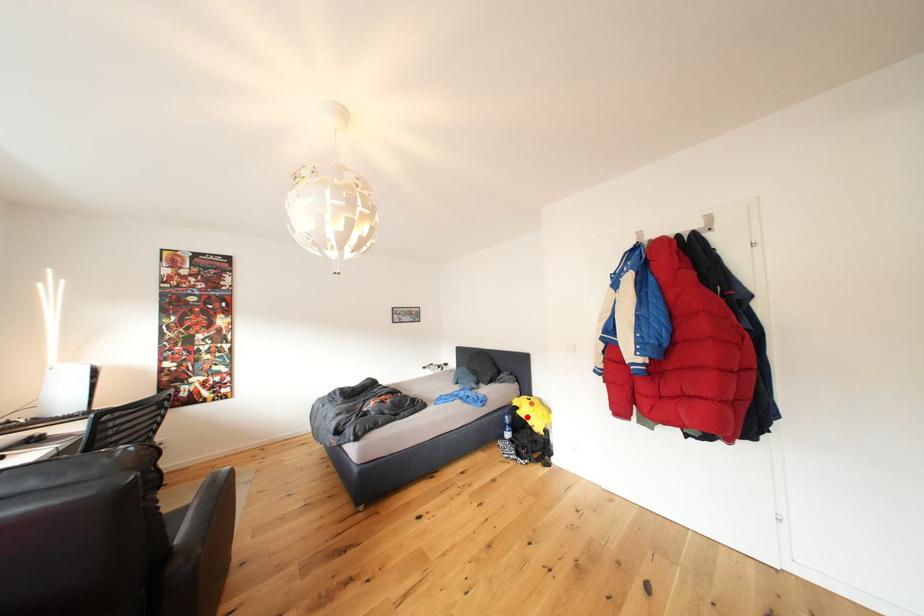
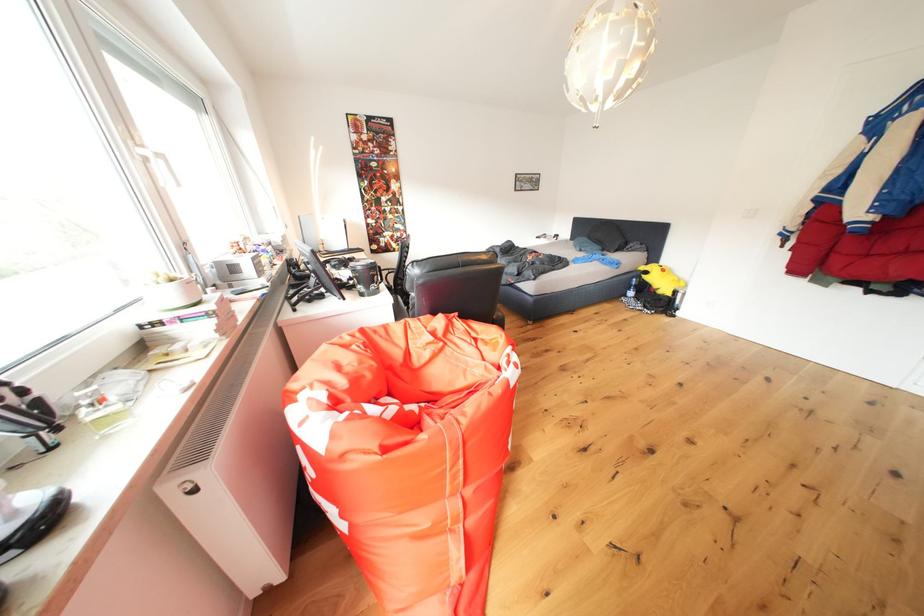
Locate, in the second image, the point that corresponds to the highlighted location in the first image.

(653, 282)